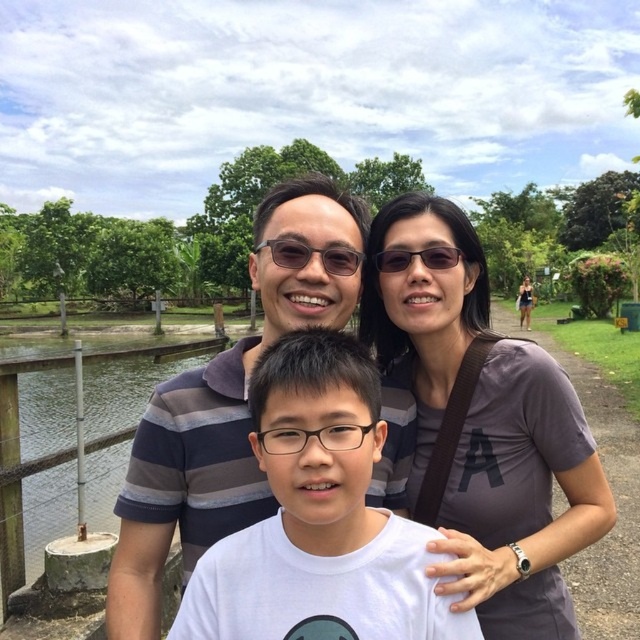
Question: Among these points, which one is farthest from the camera?

Choices:
 (A) (200, 342)
 (B) (342, 260)
 (C) (336, 332)
 (D) (406, 330)

Answer: (A)

Question: From the image, what is the correct spatial relationship of gray fabric shirt at upper center in relation to white matte shirt at center?

Choices:
 (A) below
 (B) above

Answer: (B)

Question: Which point is closer to the camera?

Choices:
 (A) (435, 262)
 (B) (152, 372)

Answer: (A)

Question: Is white matte shirt at center closer to the viewer compared to striped cotton shirt at center?

Choices:
 (A) yes
 (B) no

Answer: (A)

Question: Does gray fabric shirt at upper center lie in front of matte black glasses at center?

Choices:
 (A) no
 (B) yes

Answer: (B)

Question: Which point is closer to the camera?

Choices:
 (A) brushed metal water at left
 (B) striped cotton shirt at center

Answer: (B)